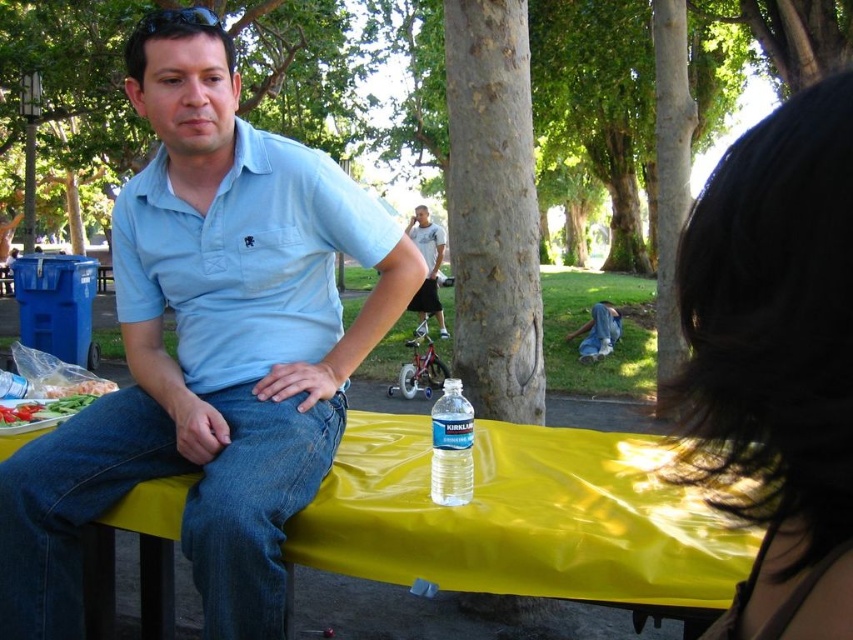
You are standing in the park and see the light blue shirt at center and the denim pants at lower right. Which object is positioned more to the right side?

The denim pants at lower right are positioned more to the right side than the light blue shirt at center.

You are a photographer setting up a tripod to take a portrait of the man at the picnic table. The denim jeans at lower left and the light blue shirt at center are both in the frame. Which object should you adjust the camera angle to focus on if you want to highlight the one that is taller?

You should focus on the denim jeans at lower left because it is taller than the light blue shirt at center.

You are standing at the center of the image. Which direction should you move to reach the denim jeans at lower left?

The denim jeans at lower left is located at point 0.805 in the x coordinate and 0.215 in the y coordinate. Since you are at the center, you need to move towards the lower left direction to reach it.